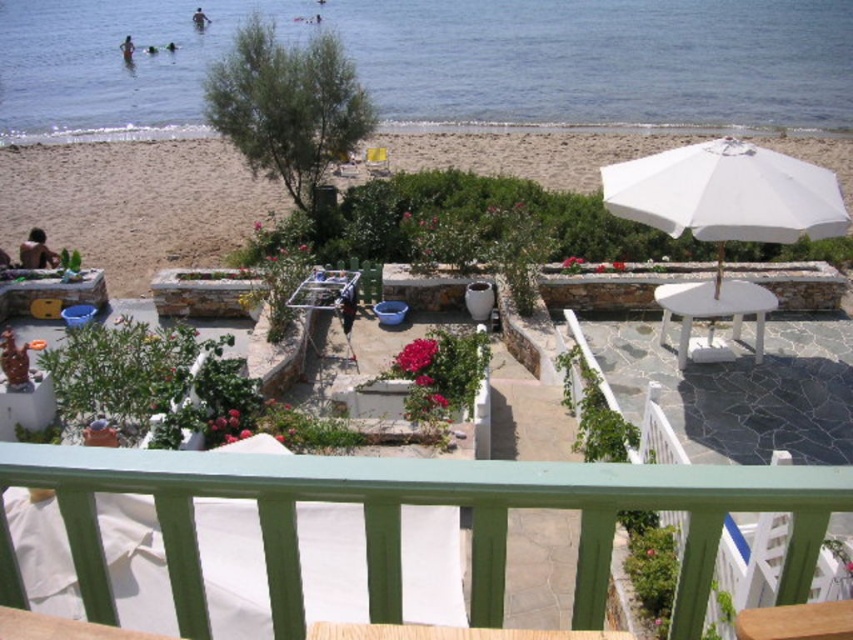
Does point (838, 161) come closer to viewer compared to point (727, 147)?

No, (838, 161) is behind (727, 147).

Does white sand at upper left have a lesser height compared to white fabric umbrella at right?

In fact, white sand at upper left may be taller than white fabric umbrella at right.

Which is in front, point (38, 189) or point (608, 168)?

Positioned in front is point (608, 168).

The image size is (853, 640). What are the coordinates of `white sand at upper left` in the screenshot? It's located at click(x=134, y=202).

Between white sand at upper left and yellow fabric chair at center, which one is positioned higher?

yellow fabric chair at center is above.

Which is below, white sand at upper left or yellow fabric chair at center?

white sand at upper left is below.

Which is in front, point (90, 237) or point (383, 157)?

Positioned in front is point (90, 237).

Find the location of a particular element. white sand at upper left is located at coordinates (134, 202).

How much distance is there between green painted wood railing at center and white glossy table at center?

green painted wood railing at center and white glossy table at center are 29.38 feet apart.

Who is positioned more to the right, green painted wood railing at center or white glossy table at center?

white glossy table at center is more to the right.

Describe the element at coordinates (422, 502) in the screenshot. This screenshot has height=640, width=853. I see `green painted wood railing at center` at that location.

The height and width of the screenshot is (640, 853). I want to click on green painted wood railing at center, so click(422, 502).